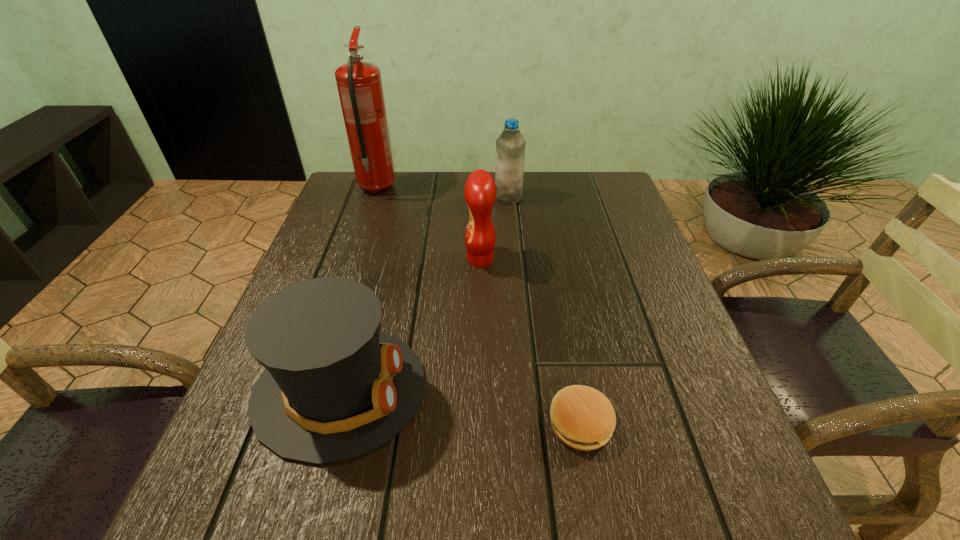
I want to click on vacant space situated with goggles on the front of the second shortest object, so click(545, 390).

Find the location of `free space located on the left of the patty`. free space located on the left of the patty is located at coordinates (364, 423).

Locate an element on the screen. The height and width of the screenshot is (540, 960). fire extinguisher that is at the far edge is located at coordinates (359, 83).

Find the location of a particular element. Image resolution: width=960 pixels, height=540 pixels. water bottle that is at the far edge is located at coordinates (510, 146).

This screenshot has height=540, width=960. Find the location of `fire extinguisher at the left edge`. fire extinguisher at the left edge is located at coordinates (359, 83).

Where is `dress hat that is positioned at the left edge`? Image resolution: width=960 pixels, height=540 pixels. dress hat that is positioned at the left edge is located at coordinates (334, 387).

This screenshot has height=540, width=960. I want to click on object present at the far left corner, so click(x=359, y=83).

Find the location of `free space at the far edge of the desktop`. free space at the far edge of the desktop is located at coordinates (440, 208).

At what (x,y) coordinates should I click in order to perform the action: click on blank space at the near edge. Please return your answer as a coordinate pair (x, y). The width and height of the screenshot is (960, 540). Looking at the image, I should click on (420, 497).

Where is `vacant region at the right edge of the desktop`? This screenshot has width=960, height=540. vacant region at the right edge of the desktop is located at coordinates (604, 222).